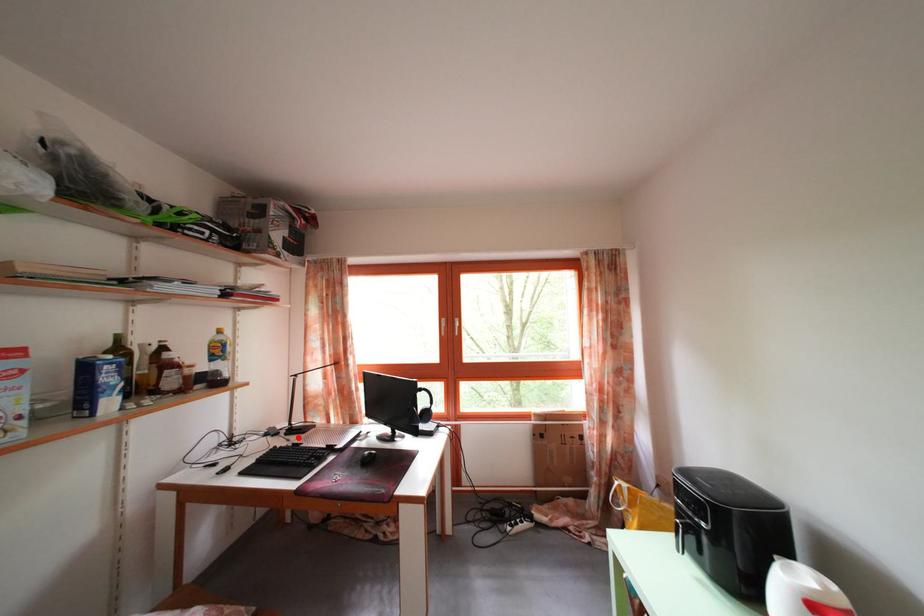
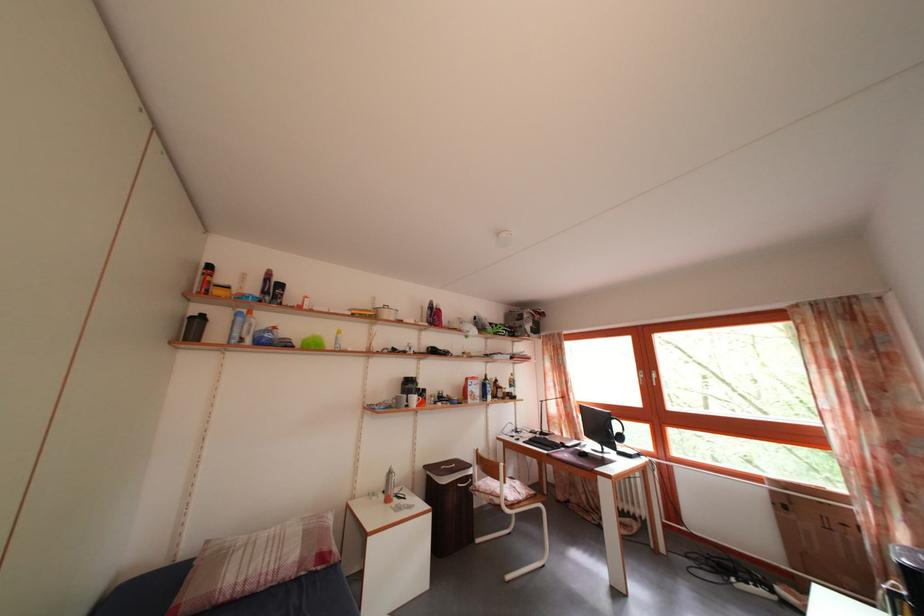
Question: I am providing you with two images of the same scene from different viewpoints. A red point is marked on the first image. Can you still see the location of the red point in image 2?

Choices:
 (A) Yes
 (B) No

Answer: (A)